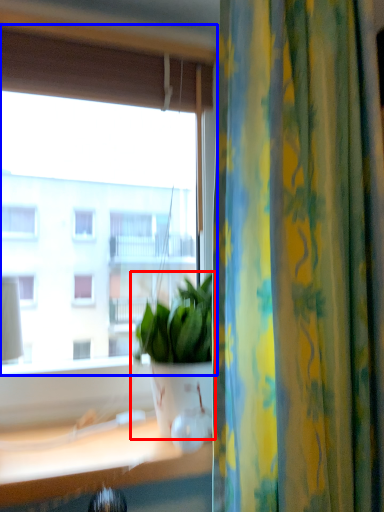
Question: Which point is closer to the camera, houseplant (highlighted by a red box) or window (highlighted by a blue box)?

Choices:
 (A) houseplant
 (B) window

Answer: (A)